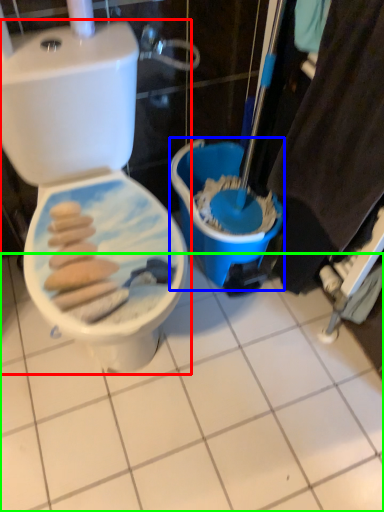
Question: Based on their relative distances, which object is nearer to toilet (highlighted by a red box)? Choose from potty (highlighted by a blue box) and ceramic tile (highlighted by a green box).

Choices:
 (A) potty
 (B) ceramic tile

Answer: (A)